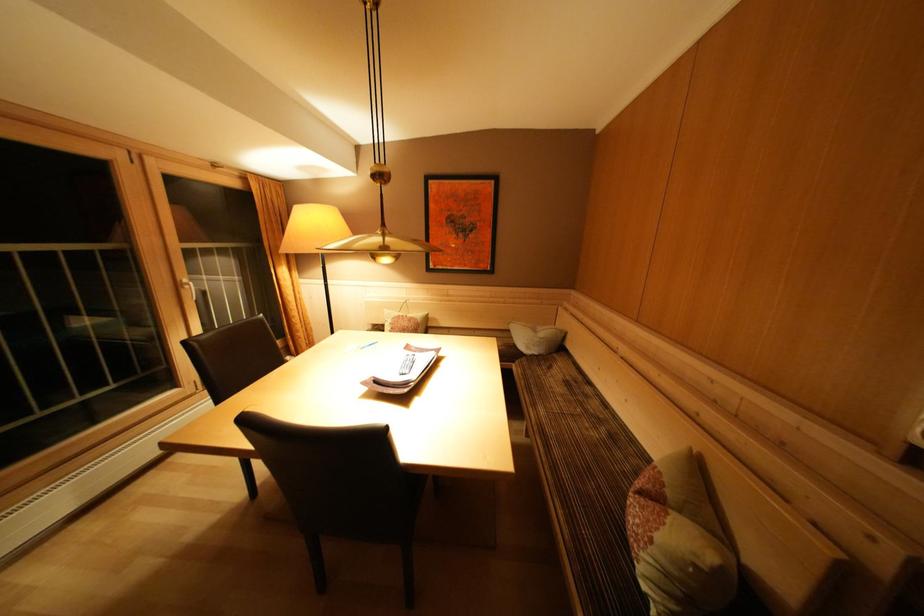
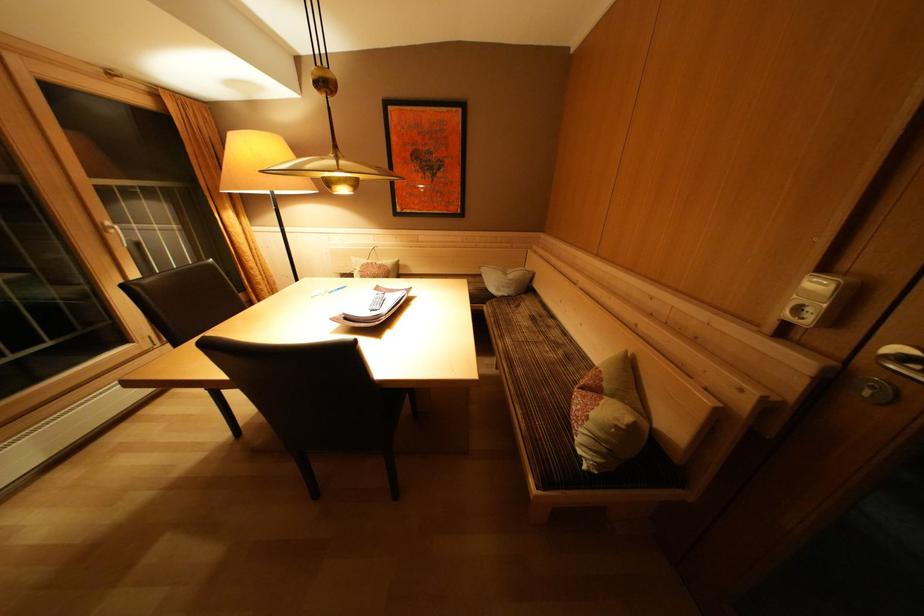
In the second image, find the point that corresponds to pixel 665 543 in the first image.

(600, 419)